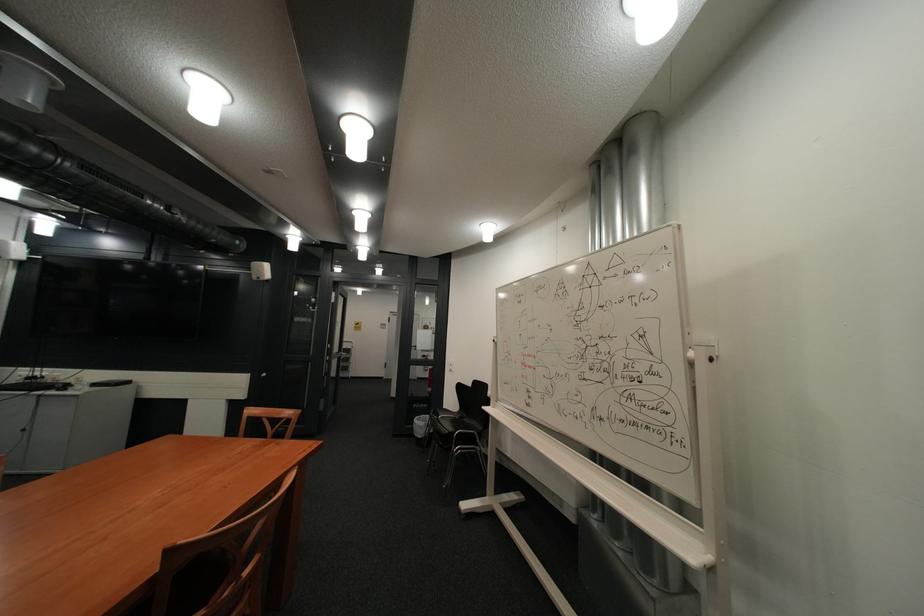
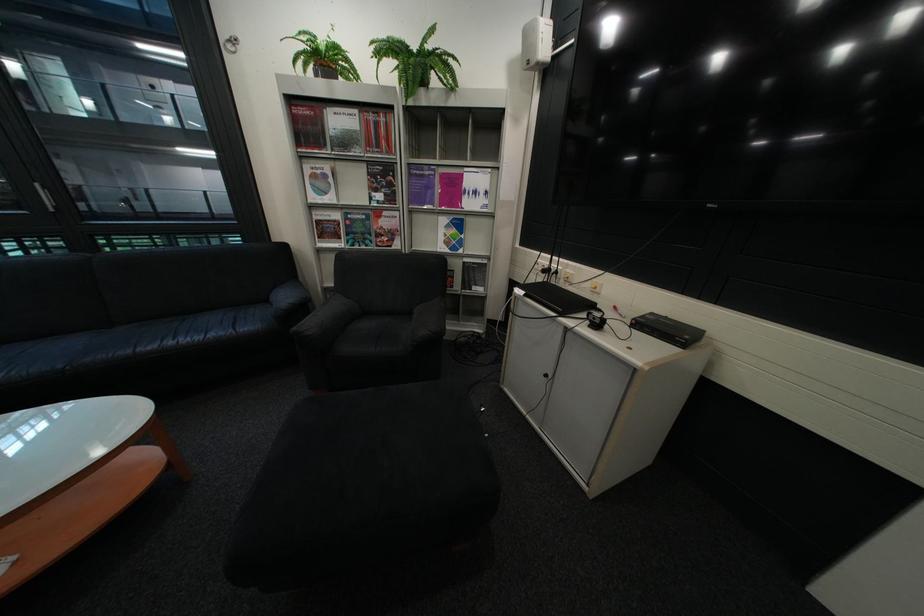
The point at (46, 378) is marked in the first image. Where is the corresponding point in the second image?

(563, 270)